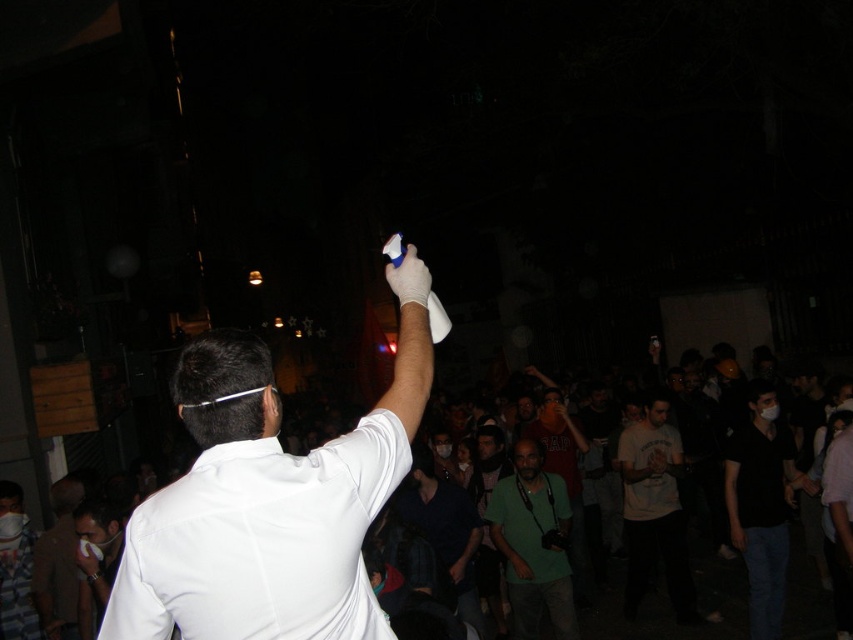
Does white matte shirt at upper center have a lesser width compared to green fabric shirt at center?

In fact, white matte shirt at upper center might be wider than green fabric shirt at center.

Between white matte shirt at upper center and green fabric shirt at center, which one has more height?

green fabric shirt at center is taller.

Is point (227, 611) closer to camera compared to point (497, 522)?

Yes, point (227, 611) is in front of point (497, 522).

Image resolution: width=853 pixels, height=640 pixels. What are the coordinates of `white matte shirt at upper center` in the screenshot? It's located at (265, 506).

Does point (119, 586) come in front of point (767, 570)?

That is True.

Consider the image. Can you confirm if white matte shirt at upper center is positioned to the left of black matte shirt at center-right?

Correct, you'll find white matte shirt at upper center to the left of black matte shirt at center-right.

Between point (363, 461) and point (766, 577), which one is positioned behind?

Positioned behind is point (766, 577).

Where is `white matte shirt at upper center`? white matte shirt at upper center is located at coordinates (265, 506).

Between point (456, 484) and point (33, 568), which one is positioned behind?

The point (456, 484) is more distant.

Is dark blue shirt at center behind light brown leather jacket at lower left?

Yes.

Does point (468, 572) come in front of point (53, 548)?

No, (468, 572) is behind (53, 548).

You are a GUI agent. You are given a task and a screenshot of the screen. Output one action in this format:
    pyautogui.click(x=<x>, y=<y>)
    Task: Click on the dark blue shirt at center
    This screenshot has height=640, width=853.
    Given the screenshot: What is the action you would take?
    pyautogui.click(x=444, y=532)